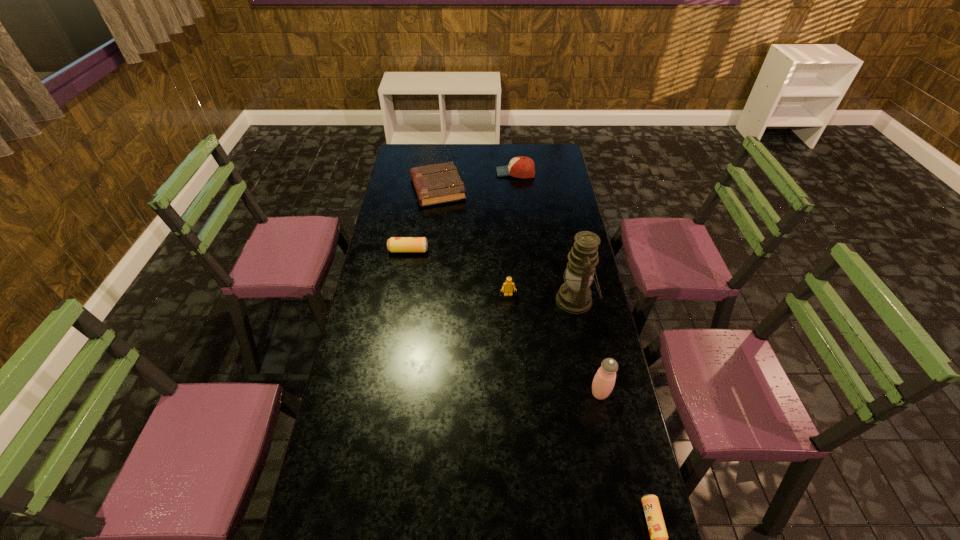
You are a GUI agent. You are given a task and a screenshot of the screen. Output one action in this format:
    pyautogui.click(x=<x>, y=<y>)
    Task: Click on the thermos bottle at the right edge
    This screenshot has width=960, height=540.
    Given the screenshot: What is the action you would take?
    pyautogui.click(x=603, y=383)

Locate an element on the screen. This screenshot has width=960, height=540. oil lamp that is at the right edge is located at coordinates (574, 296).

I want to click on object situated at the far right corner, so click(520, 167).

In the image, there is a desktop. Where is `vacant space at the far edge`? This screenshot has width=960, height=540. vacant space at the far edge is located at coordinates [442, 144].

In the image, there is a desktop. Where is `free region at the left edge`? The height and width of the screenshot is (540, 960). free region at the left edge is located at coordinates (379, 343).

What are the coordinates of `free space at the right edge of the desktop` in the screenshot? It's located at (617, 470).

Locate an element on the screen. The image size is (960, 540). vacant region at the far left corner of the desktop is located at coordinates (418, 147).

In the image, there is a desktop. Where is `blank space at the far right corner`? The width and height of the screenshot is (960, 540). blank space at the far right corner is located at coordinates (548, 147).

The height and width of the screenshot is (540, 960). I want to click on vacant space at the near right corner of the desktop, so click(591, 514).

The image size is (960, 540). I want to click on empty location between the third farthest object and the oil lamp, so click(x=492, y=275).